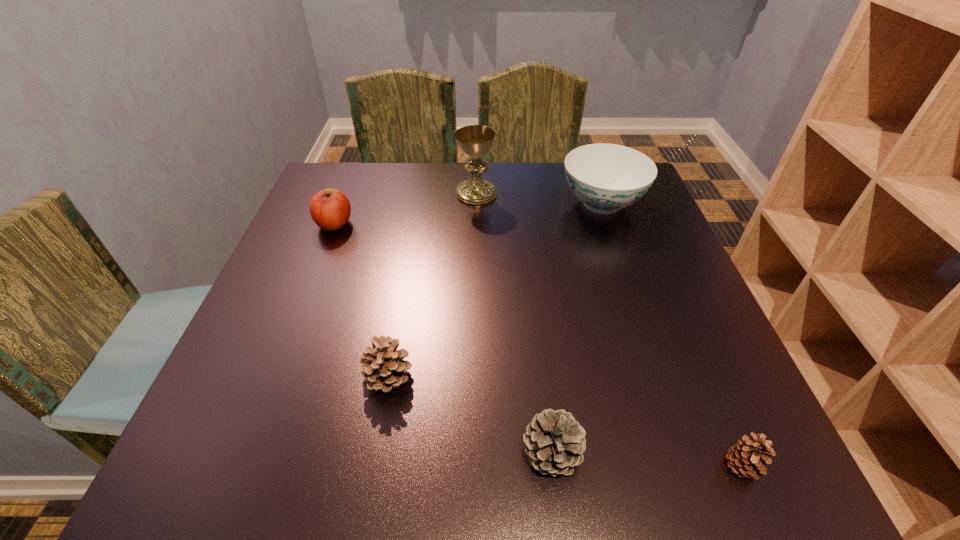
Find the location of a particular element. The width and height of the screenshot is (960, 540). the tallest object is located at coordinates pos(475,141).

Find the location of a particular element. Image resolution: width=960 pixels, height=540 pixels. the fourth object from right to left is located at coordinates (475, 141).

Where is `chinaware`? The image size is (960, 540). chinaware is located at coordinates (606, 177).

Where is `the leftmost object`? Image resolution: width=960 pixels, height=540 pixels. the leftmost object is located at coordinates (330, 209).

Image resolution: width=960 pixels, height=540 pixels. Identify the location of the fourth farthest object. (382, 366).

Locate an element on the screen. Image resolution: width=960 pixels, height=540 pixels. the leftmost pinecone is located at coordinates (382, 366).

Find the location of a particular element. the third object from right to left is located at coordinates (555, 442).

The image size is (960, 540). I want to click on the shortest pinecone, so click(x=747, y=457).

Identify the location of the rightmost pinecone. pos(747,457).

You are a GUI agent. You are given a task and a screenshot of the screen. Output one action in this format:
    pyautogui.click(x=<x>, y=<y>)
    Task: Click on the free region located on the front of the tallest object
    Image resolution: width=960 pixels, height=540 pixels.
    Given the screenshot: What is the action you would take?
    pyautogui.click(x=475, y=311)